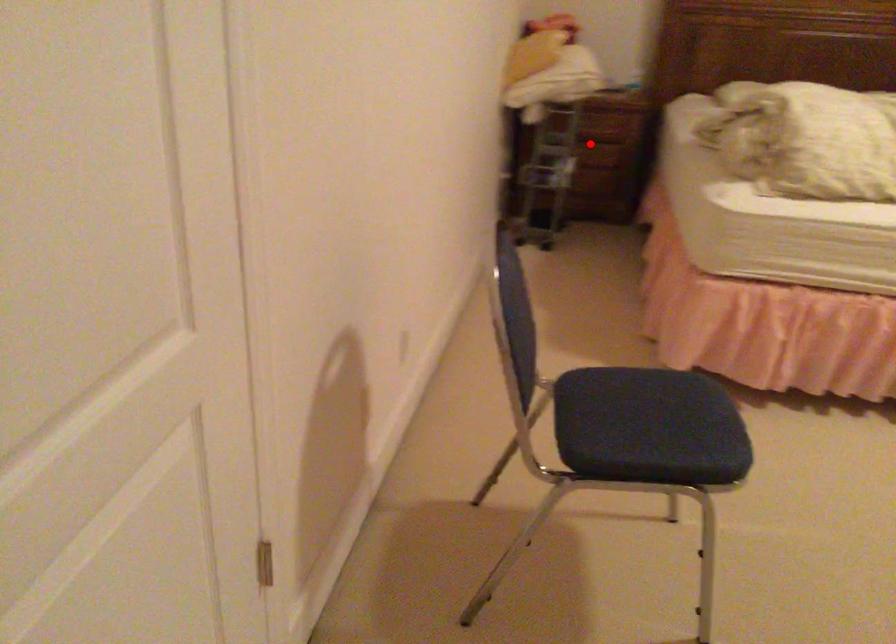
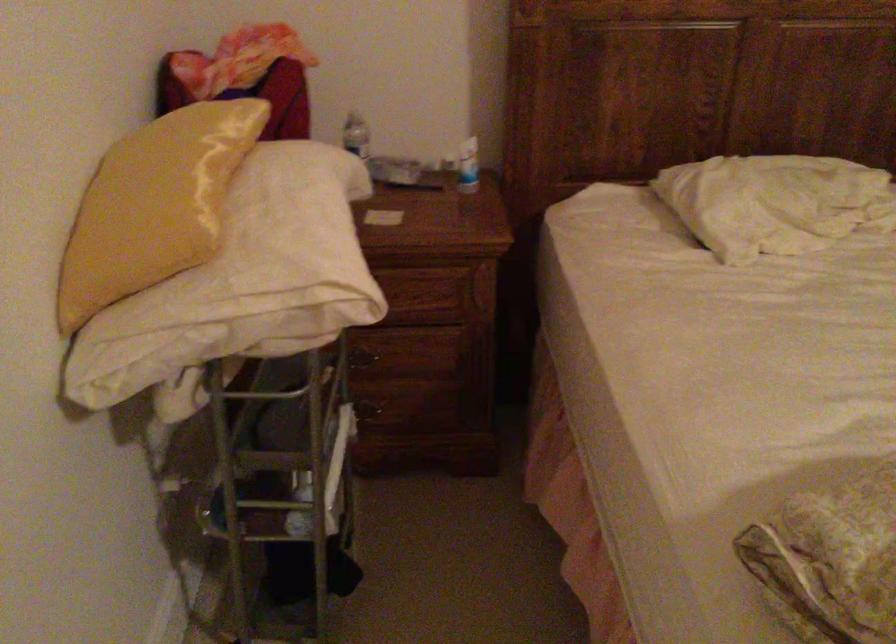
Question: I am providing you with two images of the same scene from different viewpoints. Given a red point in image1, look at the same physical point in image2. Is it:

Choices:
 (A) Closer to the viewpoint
 (B) Farther from the viewpoint

Answer: (A)